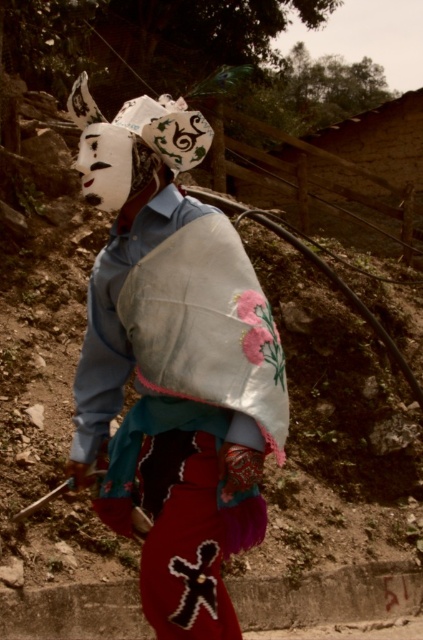
Question: Is white matte mask at upper left to the left of white fabric mask at upper center from the viewer's perspective?

Choices:
 (A) yes
 (B) no

Answer: (B)

Question: Can you confirm if white matte mask at upper left is positioned to the left of white fabric mask at upper center?

Choices:
 (A) no
 (B) yes

Answer: (A)

Question: Is white matte mask at upper left above white fabric mask at upper center?

Choices:
 (A) no
 (B) yes

Answer: (A)

Question: Among these objects, which one is nearest to the camera?

Choices:
 (A) white matte mask at upper left
 (B) white fabric mask at upper center

Answer: (A)

Question: Which object appears closest to the camera in this image?

Choices:
 (A) white fabric mask at upper center
 (B) white matte mask at upper left

Answer: (B)